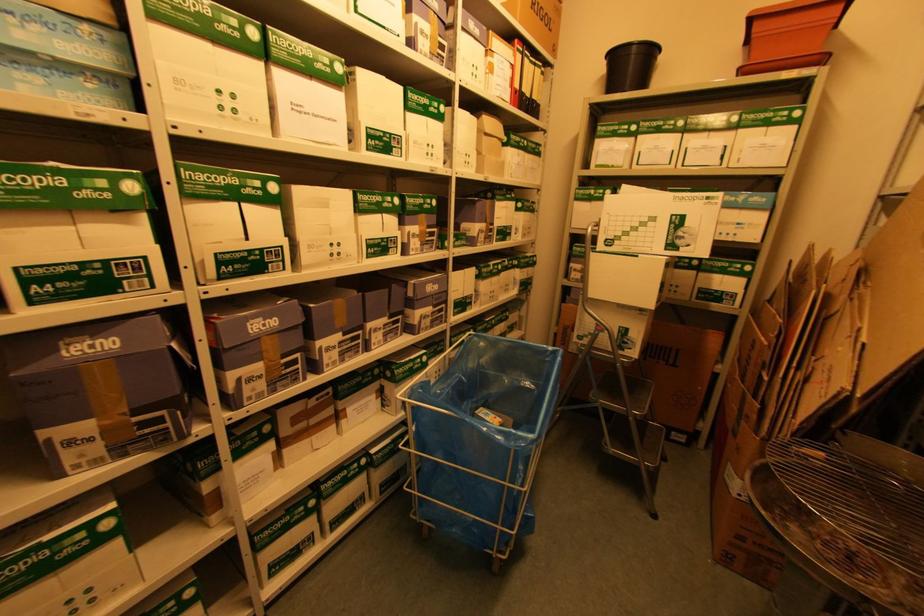
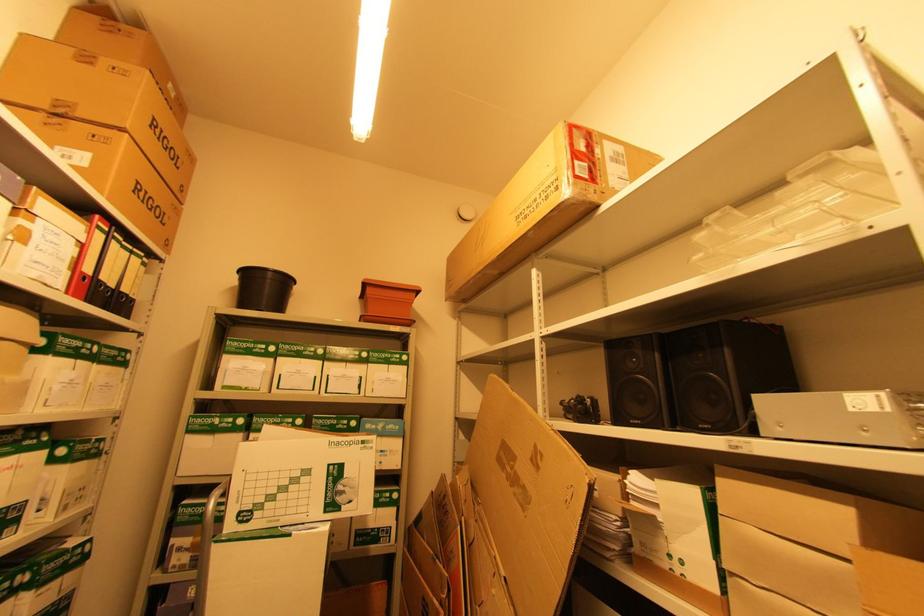
Consider the image. The images are taken continuously from a first-person perspective. In which direction is your viewpoint rotating?

The camera rotated toward right-up.